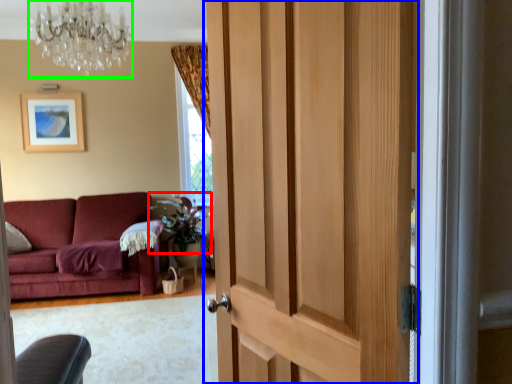
Question: Which is farther away from plant (highlighted by a red box)? door (highlighted by a blue box) or chandelier (highlighted by a green box)?

Choices:
 (A) door
 (B) chandelier

Answer: (A)